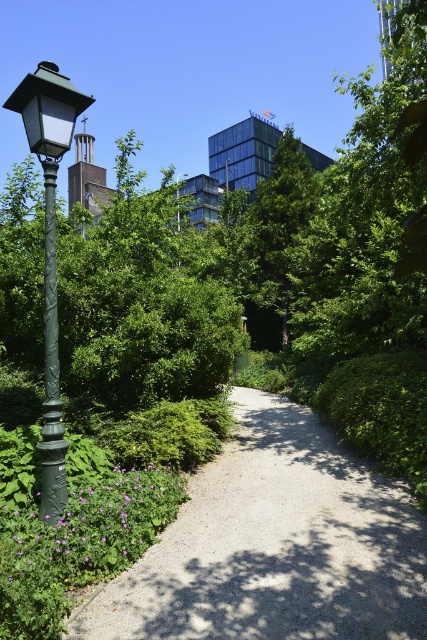
Question: Does gravel path at center appear over green textured pole at left?

Choices:
 (A) no
 (B) yes

Answer: (A)

Question: Which of the following is the farthest from the observer?

Choices:
 (A) green matte street light at upper center
 (B) green textured pole at left
 (C) gravel path at center

Answer: (A)

Question: Is gravel path at center above green matte street light at upper center?

Choices:
 (A) yes
 (B) no

Answer: (B)

Question: Can you confirm if green matte lamp post at left is positioned above green textured pole at left?

Choices:
 (A) no
 (B) yes

Answer: (B)

Question: Which point is closer to the camera?

Choices:
 (A) green textured pole at left
 (B) green matte street light at upper center
 (C) green matte lamp post at left
 (D) gravel path at center

Answer: (D)

Question: Which point is farther from the camera taking this photo?

Choices:
 (A) (55, 269)
 (B) (189, 577)
 (C) (47, 248)
 (D) (177, 204)

Answer: (D)